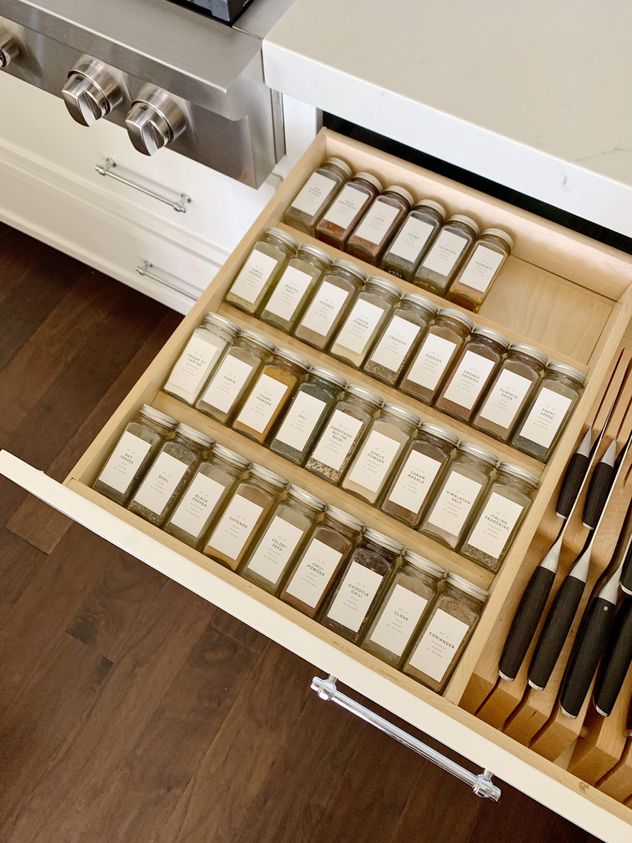
In order to click on counter top in this screenshot , I will do `click(451, 95)`.